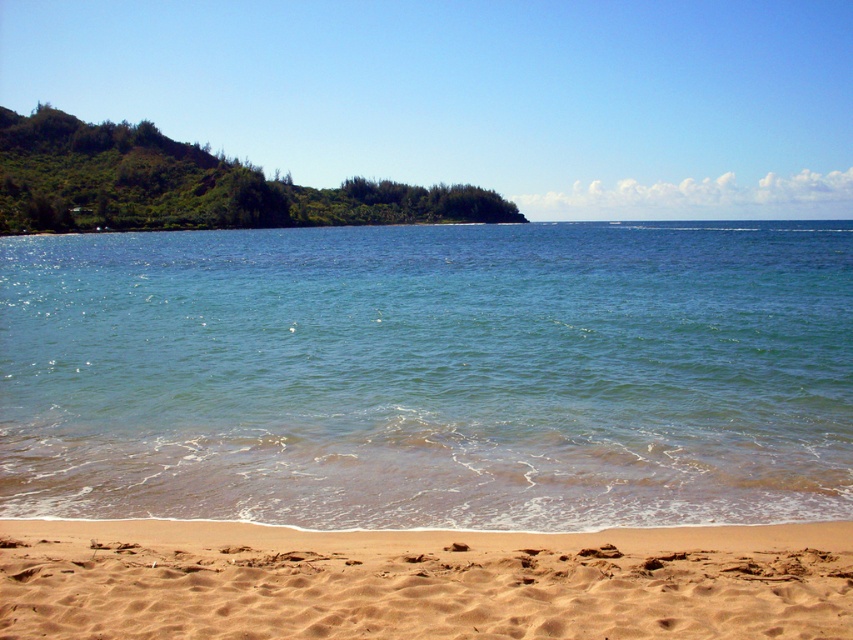
You are standing on the brown sandy beach at lower center. Looking towards the clear blue water at center, which direction should you walk to reach it?

You should walk to the right since the clear blue water at center is located to the right of the brown sandy beach at lower center.